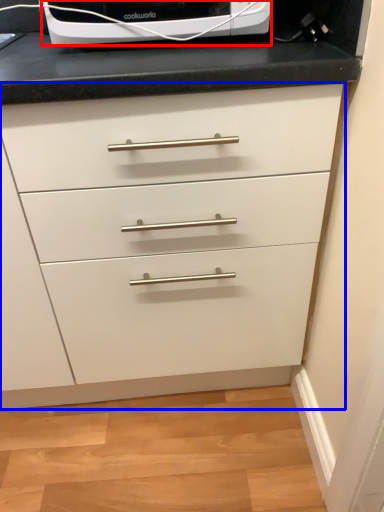
Question: Which point is further to the camera, home appliance (highlighted by a red box) or chest of drawers (highlighted by a blue box)?

Choices:
 (A) home appliance
 (B) chest of drawers

Answer: (A)